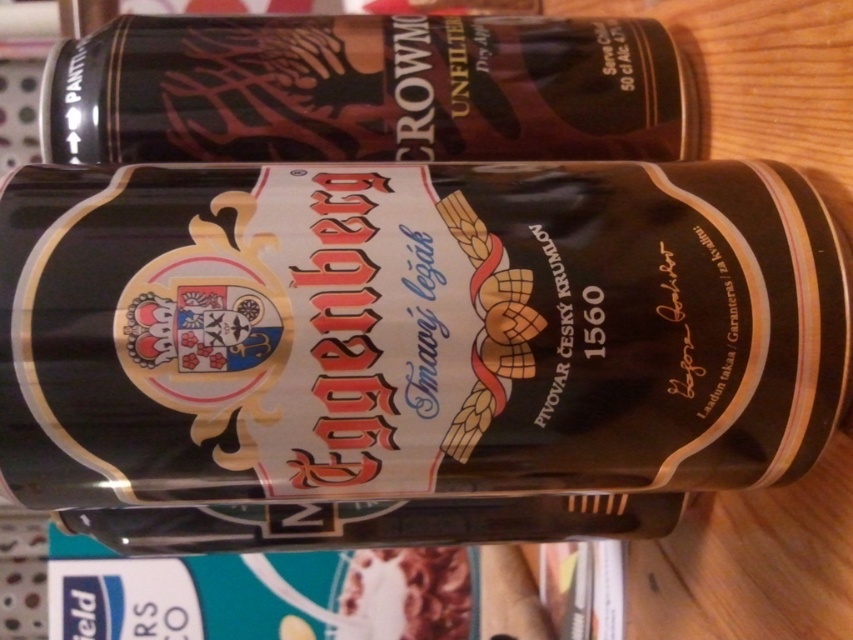
Question: Is metallic gold beer can at center closer to the viewer compared to matte black can at upper center?

Choices:
 (A) no
 (B) yes

Answer: (B)

Question: Which point is farther from the camera taking this photo?

Choices:
 (A) (86, 529)
 (B) (88, 157)

Answer: (A)

Question: Can you confirm if metallic gold beer can at center is positioned below matte black can at upper center?

Choices:
 (A) no
 (B) yes

Answer: (B)

Question: Which point is closer to the camera?

Choices:
 (A) (538, 486)
 (B) (610, 60)

Answer: (A)

Question: Is metallic gold beer can at center wider than matte black can at upper center?

Choices:
 (A) yes
 (B) no

Answer: (A)